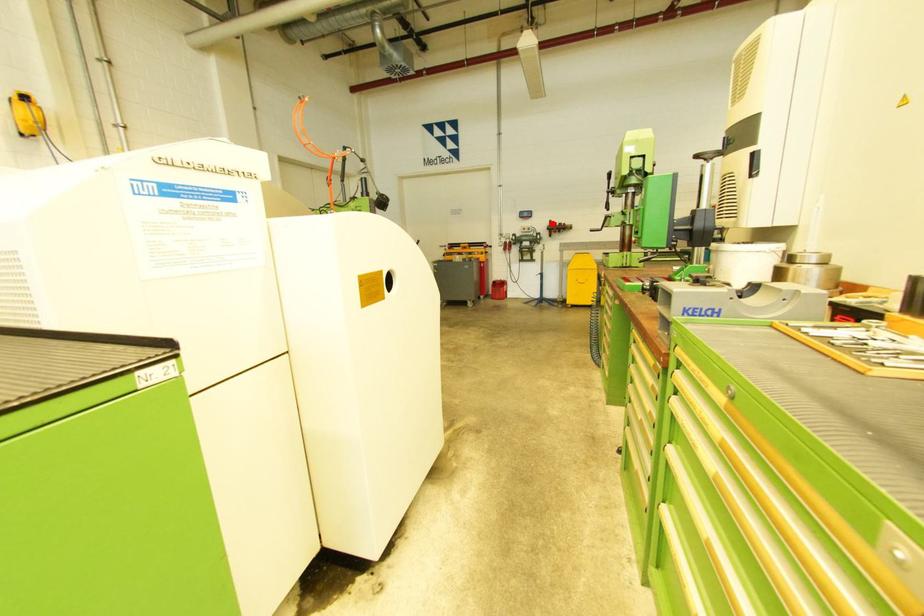
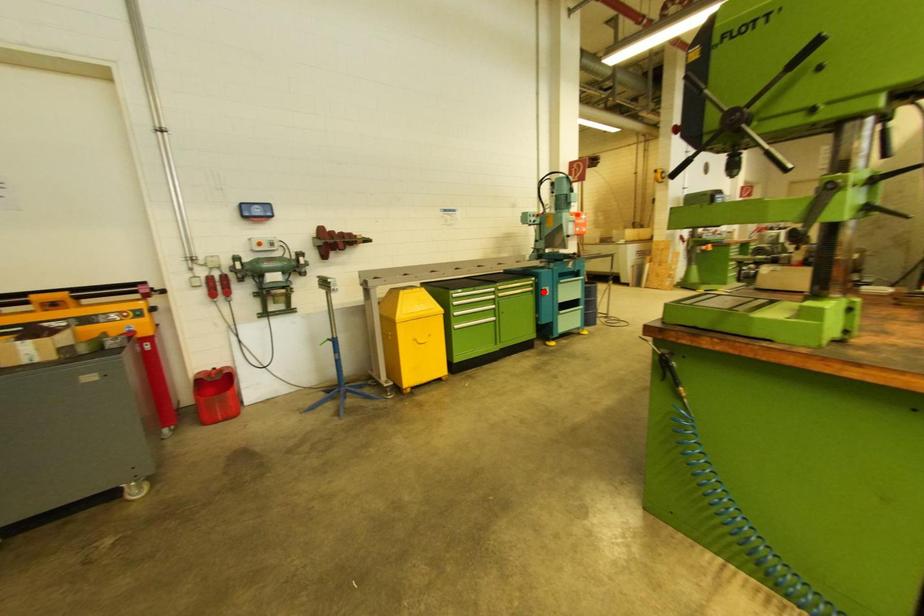
I am providing you with two images of the same scene from different viewpoints. A red point is marked on the first image and another point is marked on the second image. Do the highlighted points in image1 and image2 indicate the same real-world spot?

No